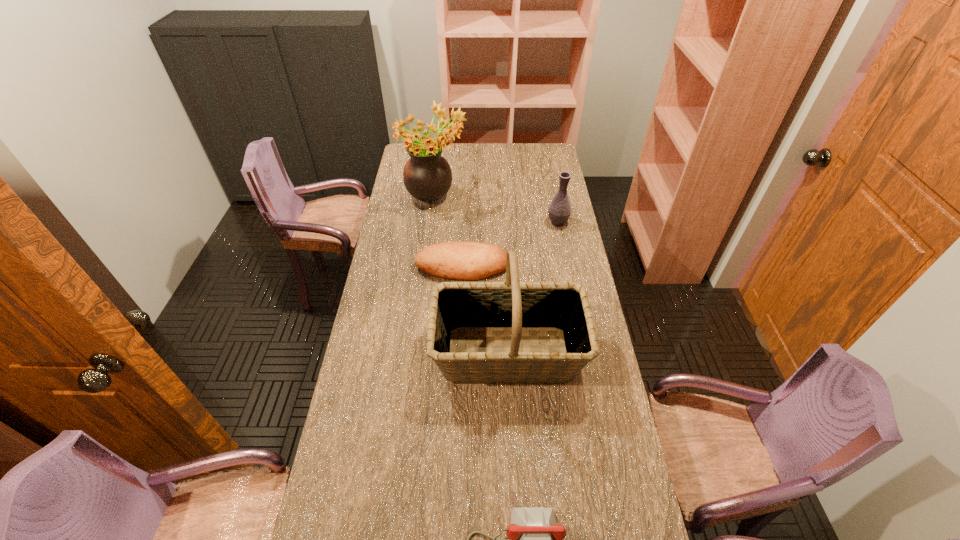
You are a GUI agent. You are given a task and a screenshot of the screen. Output one action in this format:
    pyautogui.click(x=<x>, y=<y>)
    Task: Click on the vacant space located 0.390m on the front of the third nearest object
    Image resolution: width=960 pixels, height=540 pixels.
    Given the screenshot: What is the action you would take?
    pyautogui.click(x=458, y=373)

I want to click on flower arrangement located at the left edge, so click(x=427, y=176).

The width and height of the screenshot is (960, 540). In order to click on bread that is positioned at the left edge in this screenshot , I will do `click(463, 260)`.

You are a GUI agent. You are given a task and a screenshot of the screen. Output one action in this format:
    pyautogui.click(x=<x>, y=<y>)
    Task: Click on the basket situated at the right edge
    The width and height of the screenshot is (960, 540).
    Given the screenshot: What is the action you would take?
    (563, 307)

You are a GUI agent. You are given a task and a screenshot of the screen. Output one action in this format:
    pyautogui.click(x=<x>, y=<y>)
    Task: Click on the vase located in the right edge section of the desktop
    
    Given the screenshot: What is the action you would take?
    pyautogui.click(x=559, y=210)

Image resolution: width=960 pixels, height=540 pixels. Identify the location of vacant space at the far edge. (505, 147).

Identify the location of vacant point at the left edge. The height and width of the screenshot is (540, 960). (348, 449).

Identify the location of vacant region at the right edge. Image resolution: width=960 pixels, height=540 pixels. (550, 269).

The image size is (960, 540). Find the location of `unoccupied area between the vase and the third nearest object`. unoccupied area between the vase and the third nearest object is located at coordinates (510, 245).

You are a GUI agent. You are given a task and a screenshot of the screen. Output one action in this format:
    pyautogui.click(x=<x>, y=<y>)
    Task: Click on the third closest object relative to the third tallest object
    This screenshot has width=960, height=540.
    Given the screenshot: What is the action you would take?
    pyautogui.click(x=563, y=307)